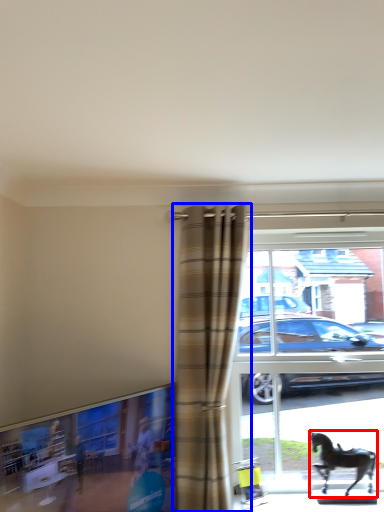
Question: Among these objects, which one is nearest to the camera, horse (highlighted by a red box) or curtain (highlighted by a blue box)?

Choices:
 (A) horse
 (B) curtain

Answer: (B)